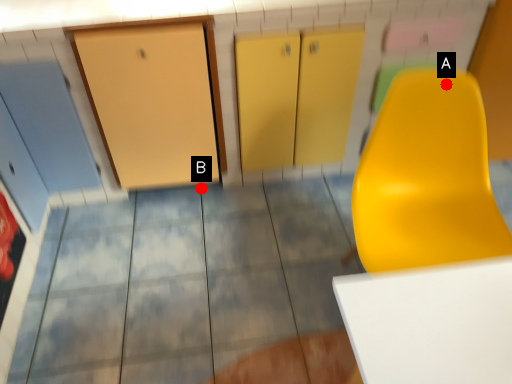
Question: Two points are circled on the image, labeled by A and B beside each circle. Which point is farther to the camera?

Choices:
 (A) A is further
 (B) B is further

Answer: (B)